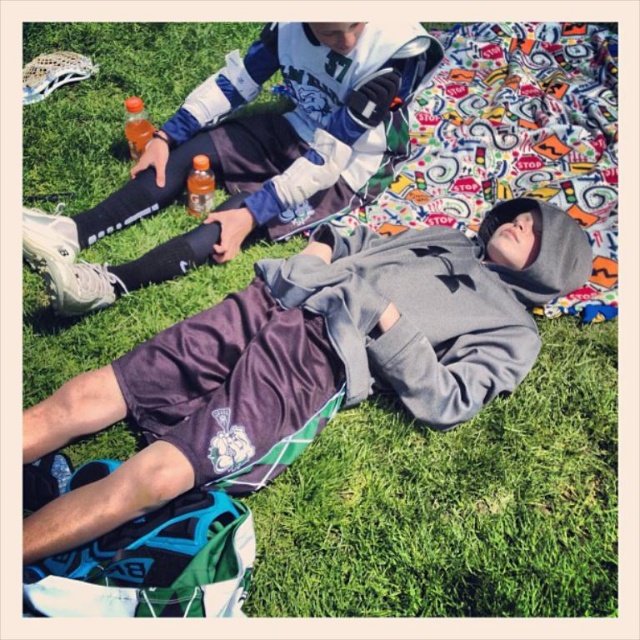
Can you confirm if gray fleece hoodie at center is positioned to the left of translucent plastic bottle at center?

No, gray fleece hoodie at center is not to the left of translucent plastic bottle at center.

Does gray fleece hoodie at center have a greater width compared to translucent plastic bottle at center?

Correct, the width of gray fleece hoodie at center exceeds that of translucent plastic bottle at center.

Is point (324, 339) positioned before point (200, 168)?

Yes.

The height and width of the screenshot is (640, 640). Find the location of `gray fleece hoodie at center`. gray fleece hoodie at center is located at coordinates (310, 356).

Is point (209, 342) closer to camera compared to point (125, 124)?

Yes.

Is point (508, 202) farther from camera compared to point (138, 129)?

No, (508, 202) is in front of (138, 129).

Identify the location of gray fleece hoodie at center. (310, 356).

Looking at this image, does gray hoodie at center have a lesser height compared to translucent orange bottle at upper left?

No.

Who is positioned more to the left, gray hoodie at center or translucent orange bottle at upper left?

From the viewer's perspective, translucent orange bottle at upper left appears more on the left side.

Locate an element on the screen. This screenshot has width=640, height=640. gray hoodie at center is located at coordinates (252, 154).